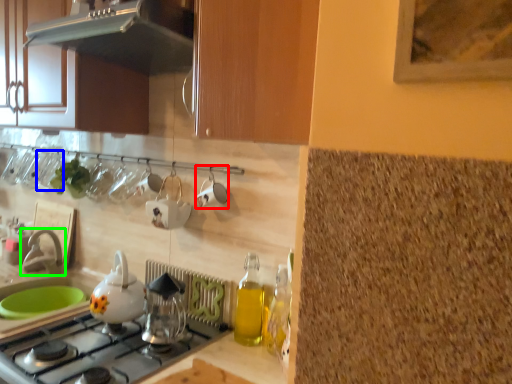
Question: Which object is the farthest from tableware (highlighted by a red box)? Choose among these: tableware (highlighted by a blue box) or tap (highlighted by a green box).

Choices:
 (A) tableware
 (B) tap

Answer: (A)